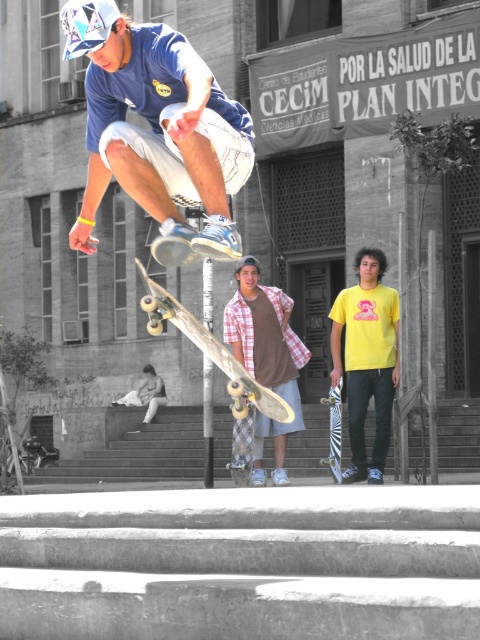
You are standing at the skate park and want to know which of the two points, point (263, 392) or point (340, 419), is closer to you. Can you determine this based on the scene?

Point (263, 392) is closer to the viewer than point (340, 419).

You are a photographer trying to capture the skateboarder midair. You need to focus on the matte blue shirt at upper center. Where should you aim your camera? Please provide coordinates in the format of a point like this example format of point format in the Objects Description.

The matte blue shirt at upper center is located at point coordinates of (154, 128).

You are a photographer trying to capture a group photo of the two observers at the skate spot. You notice the yellow matte shirt at center and the plaid shirt at center. Which observer should you move closer to the camera to ensure both are in focus?

The yellow matte shirt at center is smaller in size compared to the plaid shirt at center. To ensure both are in focus, you should move the yellow matte shirt at center closer to the camera since its smaller size might make it appear less prominent in the photo.